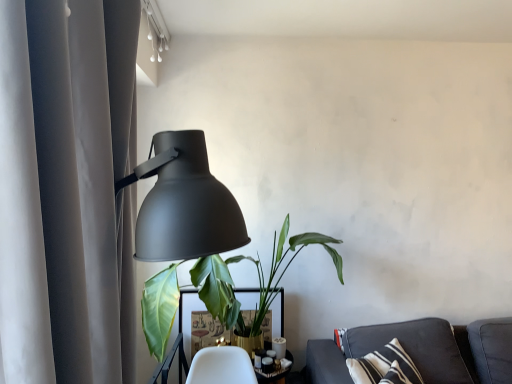
Question: Is matte gray curtain at left shorter than matte black lamp at left?

Choices:
 (A) no
 (B) yes

Answer: (A)

Question: From a real-world perspective, is matte gray curtain at left below matte black lamp at left?

Choices:
 (A) yes
 (B) no

Answer: (B)

Question: From the image's perspective, would you say matte gray curtain at left is positioned over matte black lamp at left?

Choices:
 (A) yes
 (B) no

Answer: (A)

Question: Is matte gray curtain at left at the right side of matte black lamp at left?

Choices:
 (A) no
 (B) yes

Answer: (A)

Question: Is matte gray curtain at left in front of matte black lamp at left?

Choices:
 (A) no
 (B) yes

Answer: (B)

Question: Could you tell me if matte gray curtain at left is turned towards matte black lamp at left?

Choices:
 (A) yes
 (B) no

Answer: (A)

Question: From a real-world perspective, is green leafy plant at center physically below white glossy table at center?

Choices:
 (A) yes
 (B) no

Answer: (B)

Question: Is the depth of green leafy plant at center less than that of white glossy table at center?

Choices:
 (A) no
 (B) yes

Answer: (B)

Question: From a real-world perspective, is green leafy plant at center located higher than white glossy table at center?

Choices:
 (A) yes
 (B) no

Answer: (A)

Question: Does green leafy plant at center appear on the right side of white glossy table at center?

Choices:
 (A) yes
 (B) no

Answer: (A)

Question: Is the surface of green leafy plant at center in direct contact with white glossy table at center?

Choices:
 (A) no
 (B) yes

Answer: (A)

Question: Is green leafy plant at center outside white glossy table at center?

Choices:
 (A) no
 (B) yes

Answer: (B)

Question: Is matte gray curtain at left bigger than white glossy table at center?

Choices:
 (A) yes
 (B) no

Answer: (A)